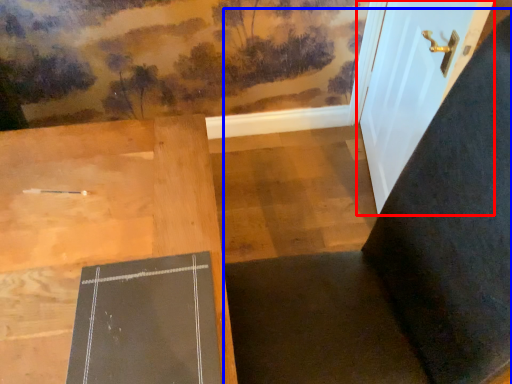
Question: Which of the following is the farthest to the observer, door (highlighted by a red box) or chair (highlighted by a blue box)?

Choices:
 (A) door
 (B) chair

Answer: (A)